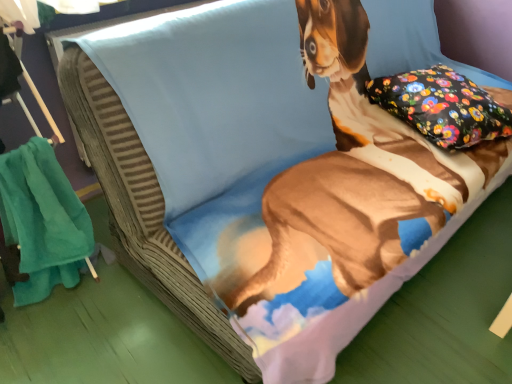
Locate an element on the screen. free space to the right of teal soft towel at left is located at coordinates (122, 317).